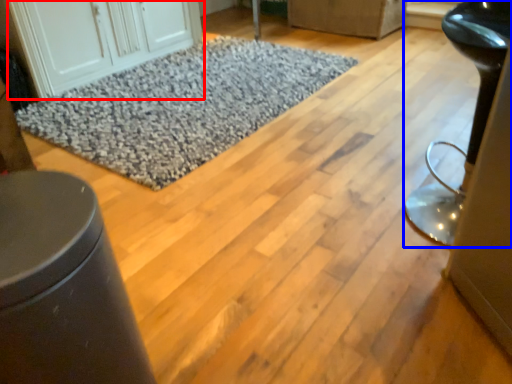
Question: Which object appears closest to the camera in this image, cabinetry (highlighted by a red box) or furniture (highlighted by a blue box)?

Choices:
 (A) cabinetry
 (B) furniture

Answer: (B)